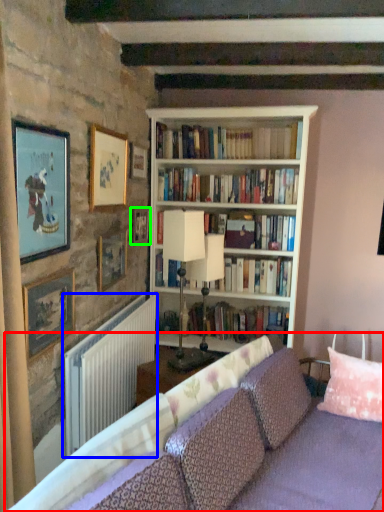
Question: Which object is positioned closest to studio couch (highlighted by a red box)? Select from radiator (highlighted by a blue box) and picture frame (highlighted by a green box).

Choices:
 (A) radiator
 (B) picture frame

Answer: (A)